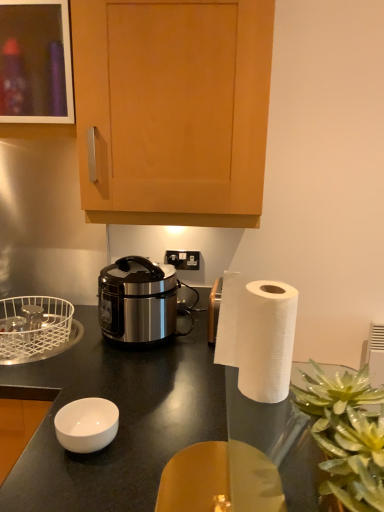
Locate an element on the screen. This screenshot has height=512, width=384. free space above black glossy desk at center (from a real-world perspective) is located at coordinates (148, 394).